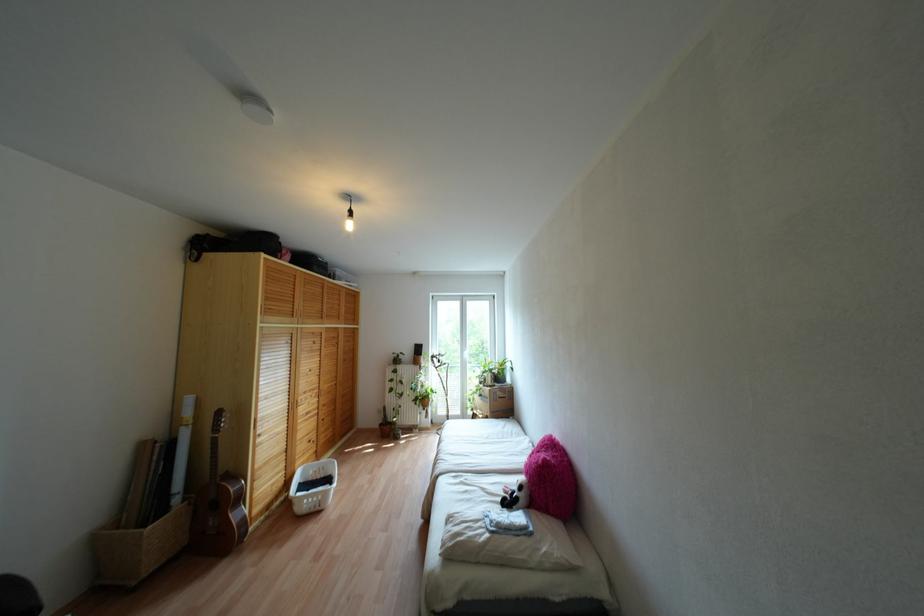
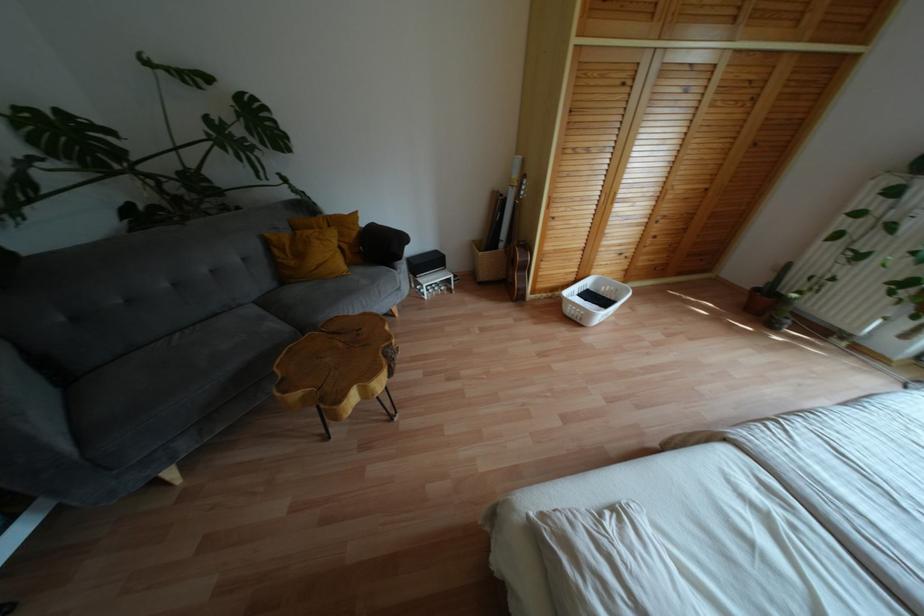
Find the pixel in the second image that matches point 238,498 in the first image.

(525, 267)